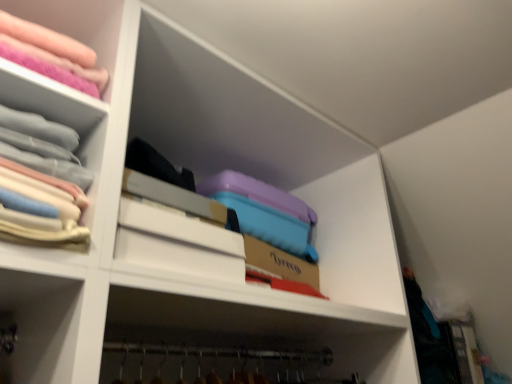
Question: Considering their positions, is matte pink fabric at upper left located in front of or behind pastel fabric stack at upper left?

Choices:
 (A) behind
 (B) front

Answer: (A)

Question: In the image, is matte pink fabric at upper left on the left side or the right side of pastel fabric stack at upper left?

Choices:
 (A) right
 (B) left

Answer: (B)

Question: In terms of width, does matte pink fabric at upper left look wider or thinner when compared to pastel fabric stack at upper left?

Choices:
 (A) thin
 (B) wide

Answer: (B)

Question: Choose the correct answer: Is pastel fabric stack at upper left inside matte pink fabric at upper left or outside it?

Choices:
 (A) outside
 (B) inside

Answer: (A)

Question: Considering the positions of pastel fabric stack at upper left and matte pink fabric at upper left in the image, is pastel fabric stack at upper left taller or shorter than matte pink fabric at upper left?

Choices:
 (A) short
 (B) tall

Answer: (B)

Question: From a real-world perspective, is pastel fabric stack at upper left above or below matte pink fabric at upper left?

Choices:
 (A) below
 (B) above

Answer: (A)

Question: Is point (53, 94) positioned closer to the camera than point (111, 56)?

Choices:
 (A) farther
 (B) closer

Answer: (B)